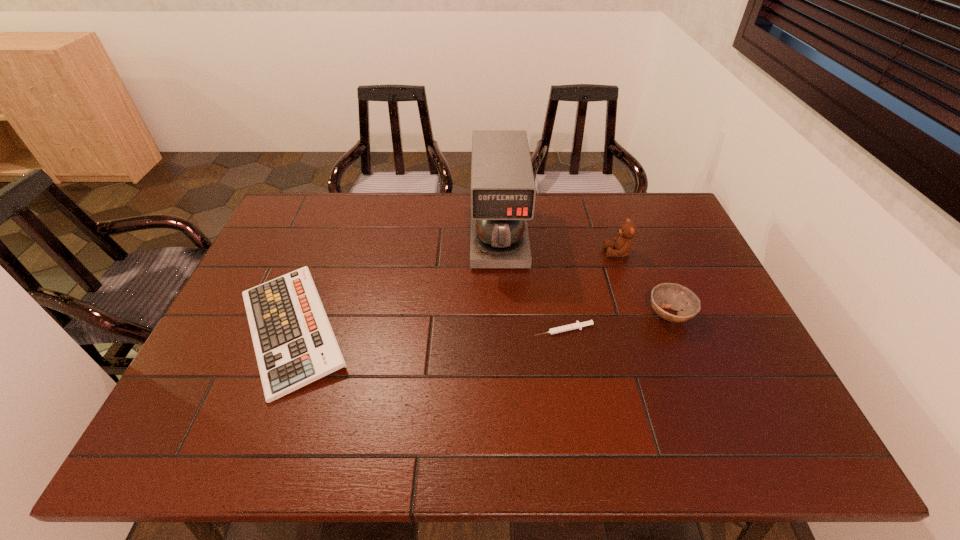
This screenshot has height=540, width=960. Find the location of `blank space at the far right corner of the desktop`. blank space at the far right corner of the desktop is located at coordinates (684, 226).

Locate an element on the screen. The image size is (960, 540). vacant area that lies between the shortest object and the third tallest object is located at coordinates (616, 322).

Where is `vacant region between the second shortest object and the bowl`? The width and height of the screenshot is (960, 540). vacant region between the second shortest object and the bowl is located at coordinates (480, 322).

Find the location of a particular element. This screenshot has width=960, height=540. free space between the fourth tallest object and the coffee maker is located at coordinates (396, 282).

You are a GUI agent. You are given a task and a screenshot of the screen. Output one action in this format:
    pyautogui.click(x=<x>, y=<y>)
    Task: Click on the vacant space that is in between the teddy bear and the bowl
    The image size is (960, 540).
    Given the screenshot: What is the action you would take?
    pyautogui.click(x=643, y=284)

Find the location of a particular element. The height and width of the screenshot is (540, 960). free space between the bowl and the syringe is located at coordinates (616, 322).

Locate an element on the screen. This screenshot has width=960, height=540. free space between the second tallest object and the shortest object is located at coordinates (590, 291).

You are a GUI agent. You are given a task and a screenshot of the screen. Output one action in this format:
    pyautogui.click(x=<x>, y=<y>)
    Task: Click on the free space between the third tallest object and the teddy bear
    The width and height of the screenshot is (960, 540).
    Given the screenshot: What is the action you would take?
    pyautogui.click(x=643, y=284)

Identify the location of vacant area that lies between the fourth shortest object and the syringe. (590, 291).

Locate an element on the screen. The width and height of the screenshot is (960, 540). empty space between the shortest object and the fourth shortest object is located at coordinates (590, 291).